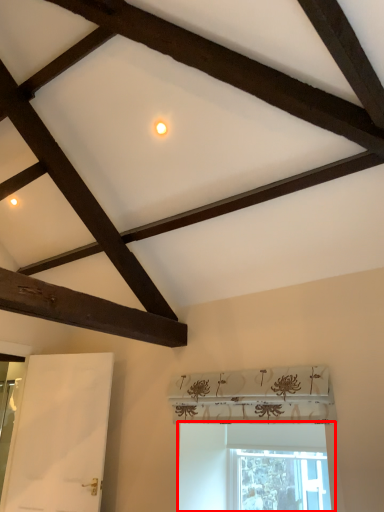
Question: From the image's perspective, what is the correct spatial positioning of window (annotated by the red box) in reference to screen door?

Choices:
 (A) above
 (B) below

Answer: (B)